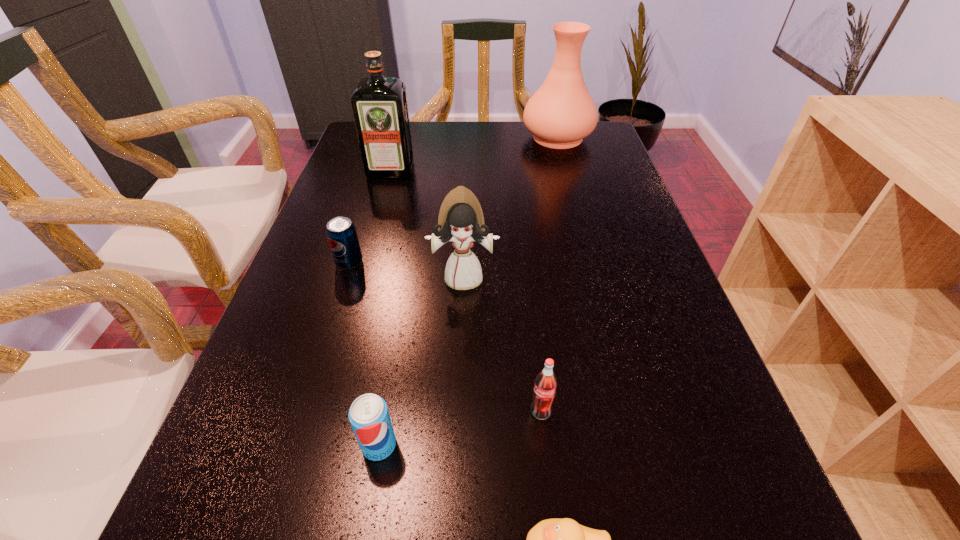
The width and height of the screenshot is (960, 540). What are the coordinates of `free space located on the front label of the liquor` in the screenshot? It's located at (362, 272).

Locate an element on the screen. Image resolution: width=960 pixels, height=540 pixels. free space located 0.350m at the front face of the fourth object from right to left is located at coordinates (457, 461).

You are a GUI agent. You are given a task and a screenshot of the screen. Output one action in this format:
    pyautogui.click(x=<x>, y=<y>)
    Task: Click on the vacant position located 0.090m on the label of the tallest soda can
    The width and height of the screenshot is (960, 540).
    Given the screenshot: What is the action you would take?
    pyautogui.click(x=548, y=477)

The height and width of the screenshot is (540, 960). I want to click on free space located on the right of the second soda can from right to left, so click(x=455, y=445).

I want to click on vacant region located on the right of the leftmost soda can, so click(x=435, y=262).

Locate an element on the screen. The height and width of the screenshot is (540, 960). object positioned at the far edge is located at coordinates (561, 113).

In order to click on liquor located at the left edge in this screenshot , I will do `click(379, 104)`.

Where is `soda can at the left edge`? soda can at the left edge is located at coordinates (341, 233).

This screenshot has height=540, width=960. I want to click on object that is positioned at the right edge, so click(561, 113).

At what (x,y) coordinates should I click in order to perform the action: click on object located in the far right corner section of the desktop. Please return your answer as a coordinate pair (x, y). The height and width of the screenshot is (540, 960). Looking at the image, I should click on (561, 113).